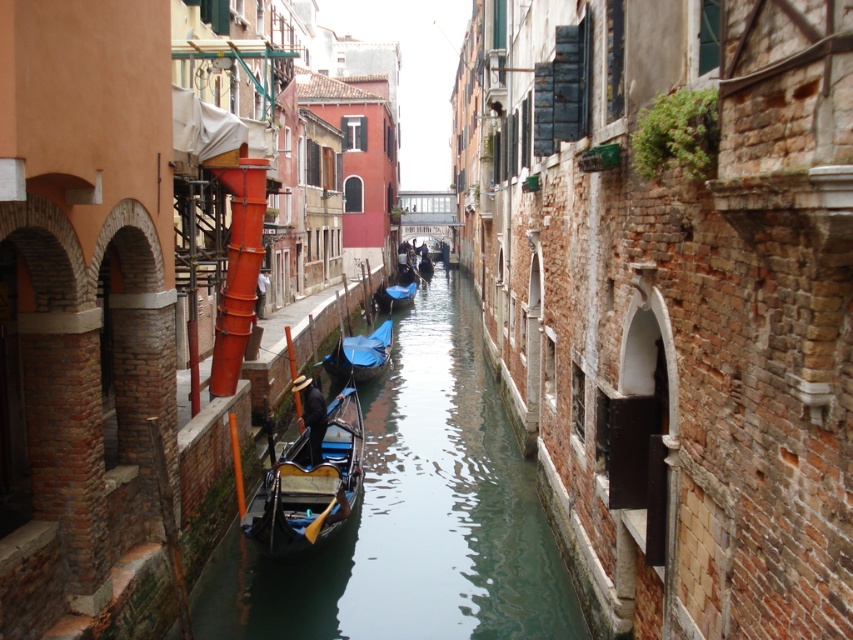
This screenshot has width=853, height=640. I want to click on wooden gondola at center, so click(309, 480).

What do you see at coordinates (309, 480) in the screenshot? I see `wooden gondola at center` at bounding box center [309, 480].

Who is more forward, (329, 522) or (397, 298)?

Point (329, 522) is more forward.

I want to click on wooden gondola at center, so click(309, 480).

Between point (339, 512) and point (361, 336), which one is positioned behind?

The point (361, 336) is behind.

Does wooden gondola at center have a greater width compared to blue glossy gondola at center?

Incorrect, wooden gondola at center's width does not surpass blue glossy gondola at center's.

Identify the location of wooden gondola at center. (309, 480).

Does point (416, 444) come closer to viewer compared to point (412, 275)?

Yes, point (416, 444) is in front of point (412, 275).

Does smooth dark blue water at center have a greater height compared to blue fabric boat at center?

In fact, smooth dark blue water at center may be shorter than blue fabric boat at center.

Is point (502, 408) positioned after point (413, 275)?

No, (502, 408) is closer to viewer.

At what (x,y) coordinates should I click in order to perform the action: click on smooth dark blue water at center. Please return your answer as a coordinate pair (x, y). Image resolution: width=853 pixels, height=640 pixels. Looking at the image, I should click on (415, 515).